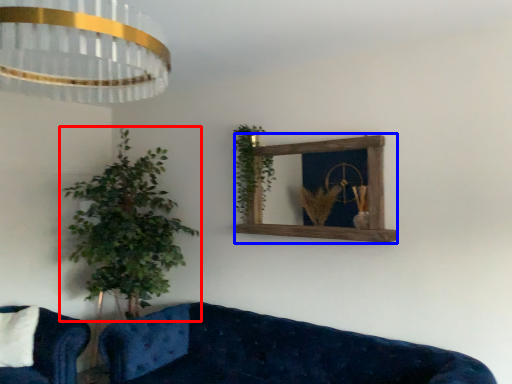
Question: Which of the following is the closest to the observer, houseplant (highlighted by a red box) or window frame (highlighted by a blue box)?

Choices:
 (A) houseplant
 (B) window frame

Answer: (B)